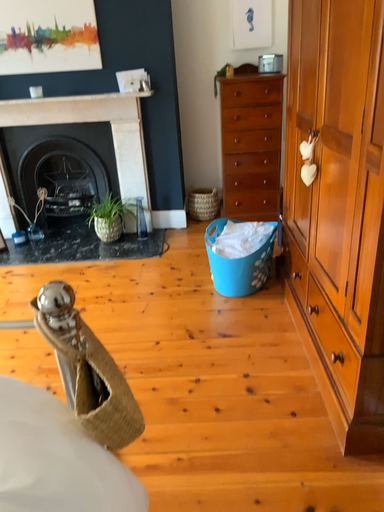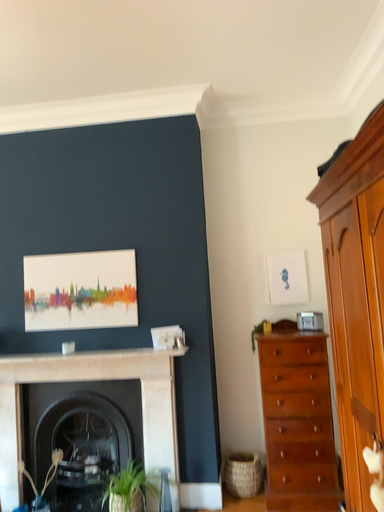
Question: Which way did the camera rotate in the video?

Choices:
 (A) rotated downward
 (B) rotated upward

Answer: (B)